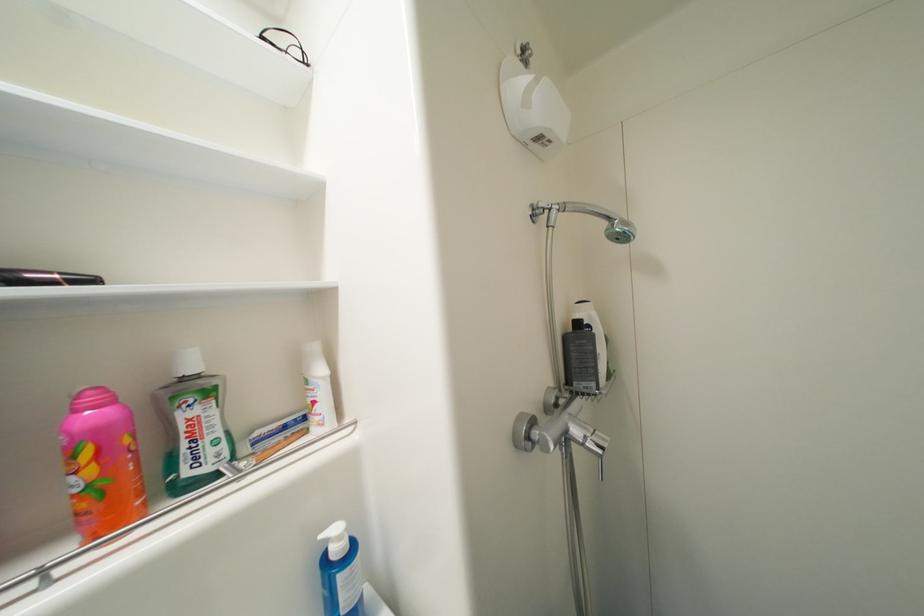
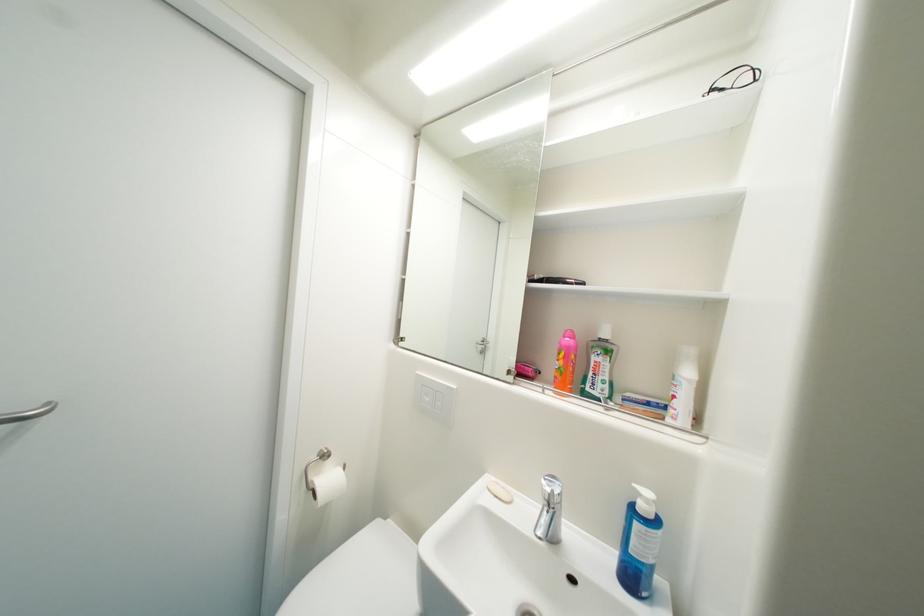
In the second image, find the point that corresponds to point (332, 559) in the first image.

(641, 507)